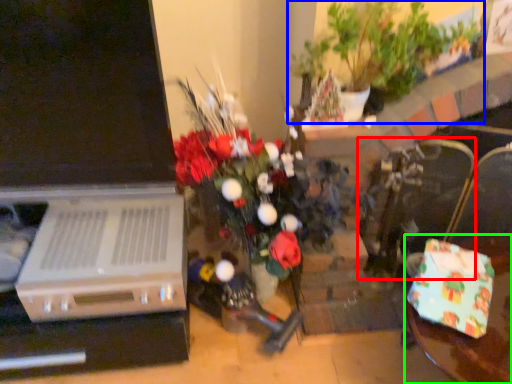
Question: Based on their relative distances, which object is nearer to armchair (highlighted by a red box)? Choose from houseplant (highlighted by a blue box) and table (highlighted by a green box).

Choices:
 (A) houseplant
 (B) table

Answer: (B)